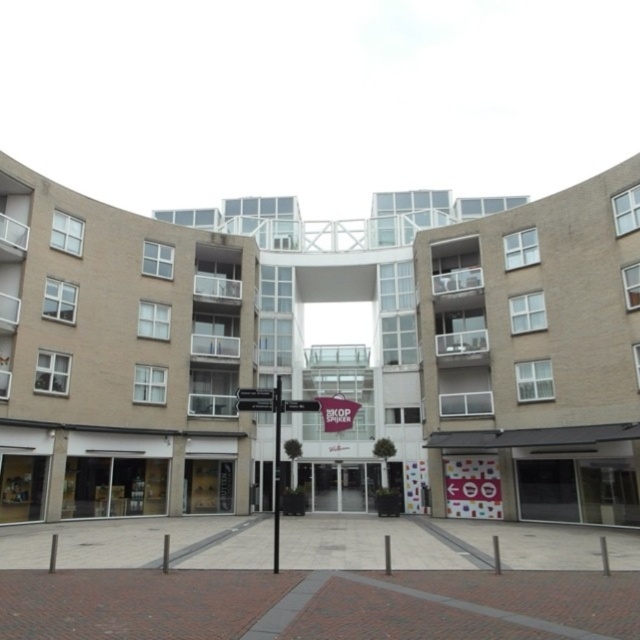
Question: Is the position of beige concrete building at left more distant than that of black metal pole at center?

Choices:
 (A) yes
 (B) no

Answer: (A)

Question: Which of the following is the closest to the observer?

Choices:
 (A) (508, 342)
 (B) (292, 406)

Answer: (B)

Question: Is beige brick building at center positioned before black metal pole at center?

Choices:
 (A) yes
 (B) no

Answer: (B)

Question: Which is farther from the black metal signpost at center?

Choices:
 (A) beige concrete building at left
 (B) black metal pole at center
 (C) beige brick building at center

Answer: (C)

Question: Which object appears closest to the camera in this image?

Choices:
 (A) beige concrete building at left
 (B) beige brick building at center

Answer: (B)

Question: Considering the relative positions of beige concrete building at left and black metal signpost at center in the image provided, where is beige concrete building at left located with respect to black metal signpost at center?

Choices:
 (A) below
 (B) above

Answer: (B)